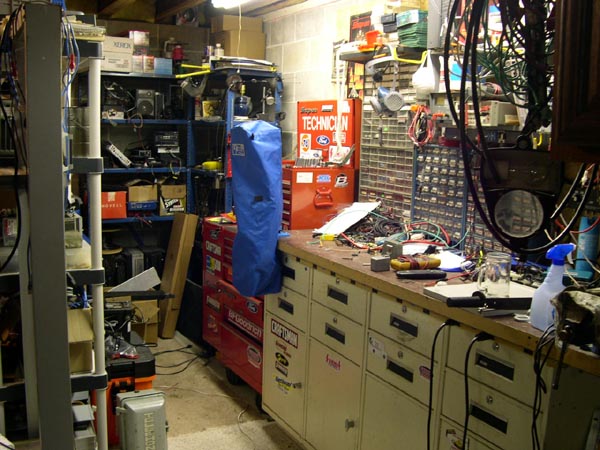
Find the location of `light`. light is located at coordinates (220, 9).